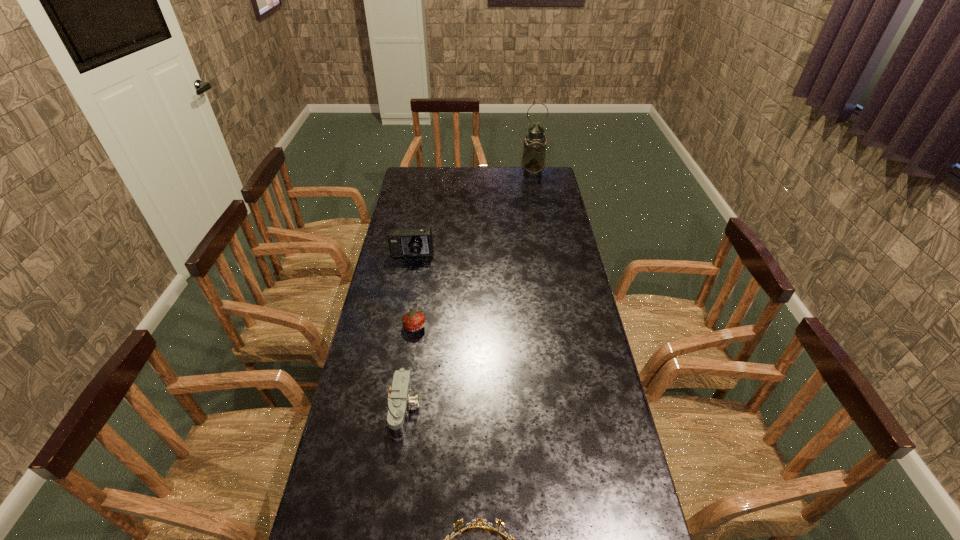
Where is `the tallest object`? the tallest object is located at coordinates (533, 162).

Image resolution: width=960 pixels, height=540 pixels. Find the location of `the farthest object`. the farthest object is located at coordinates (533, 162).

In order to click on the taller camera in this screenshot , I will do `click(410, 242)`.

This screenshot has height=540, width=960. In order to click on the farther camera in this screenshot , I will do `click(410, 242)`.

Locate an element on the screen. This screenshot has width=960, height=540. the fourth farthest object is located at coordinates (400, 400).

Locate an element on the screen. the shorter camera is located at coordinates [400, 400].

You are a GUI agent. You are given a task and a screenshot of the screen. Output one action in this format:
    pyautogui.click(x=<x>, y=<y>)
    Task: Click on the third nearest object
    Image resolution: width=960 pixels, height=540 pixels.
    Given the screenshot: What is the action you would take?
    pyautogui.click(x=413, y=321)

Find the location of a particular element. This screenshot has height=540, width=960. free space located on the left of the oil lamp is located at coordinates (484, 173).

This screenshot has height=540, width=960. Identify the location of vacant space located 0.270m on the front-facing side of the second farthest object. (402, 312).

Locate an element on the screen. vacant space located 0.400m on the lens of the second nearest object is located at coordinates (559, 410).